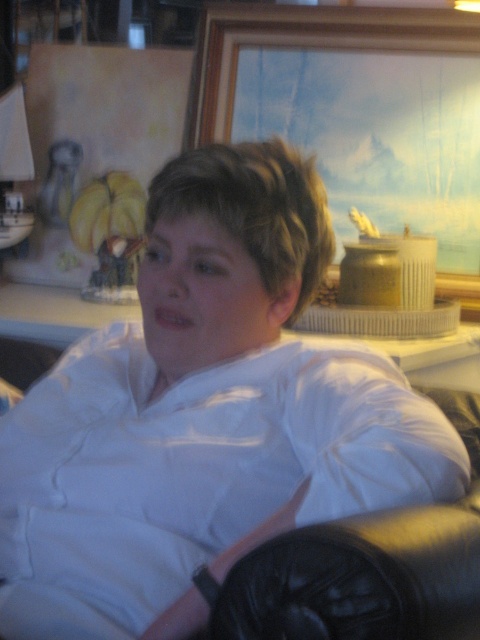
Does wooden picture frame at upper center come behind yellow matte bananas at upper left?

Result: No, wooden picture frame at upper center is in front of yellow matte bananas at upper left.

Which is behind, point (349, 45) or point (99, 216)?

Positioned behind is point (99, 216).

The width and height of the screenshot is (480, 640). In order to click on wooden picture frame at upper center in this screenshot , I will do `click(309, 45)`.